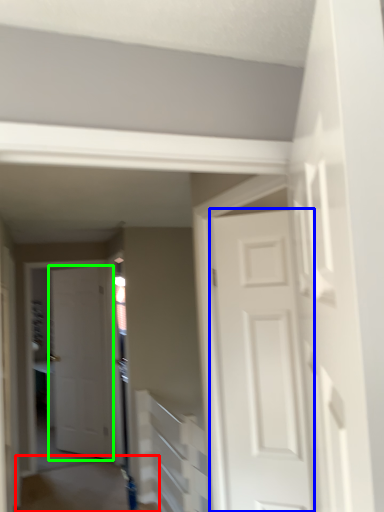
Question: Which object is positioned farthest from path (highlighted by a red box)? Select from door (highlighted by a blue box) and door (highlighted by a green box).

Choices:
 (A) door
 (B) door

Answer: (A)